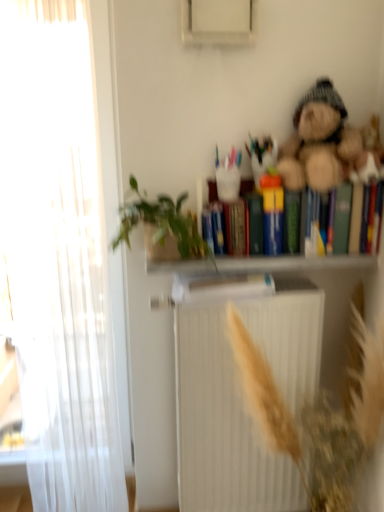
Question: Is multicolored hardcover books at upper right turned away from white matte bookcase at upper center?

Choices:
 (A) no
 (B) yes

Answer: (A)

Question: From a real-world perspective, is multicolored hardcover books at upper right below white matte bookcase at upper center?

Choices:
 (A) yes
 (B) no

Answer: (B)

Question: Considering the relative positions of multicolored hardcover books at upper right and white matte bookcase at upper center in the image provided, is multicolored hardcover books at upper right in front of white matte bookcase at upper center?

Choices:
 (A) no
 (B) yes

Answer: (A)

Question: Is multicolored hardcover books at upper right further to the viewer compared to white matte bookcase at upper center?

Choices:
 (A) no
 (B) yes

Answer: (B)

Question: From the image's perspective, is multicolored hardcover books at upper right located above white matte bookcase at upper center?

Choices:
 (A) yes
 (B) no

Answer: (A)

Question: Is multicolored hardcover books at upper right bigger than white matte bookcase at upper center?

Choices:
 (A) no
 (B) yes

Answer: (A)

Question: Does white matte radiator at center have a greater width compared to multicolored hardcover books at upper right?

Choices:
 (A) no
 (B) yes

Answer: (B)

Question: From the image's perspective, is white matte radiator at center located above multicolored hardcover books at upper right?

Choices:
 (A) yes
 (B) no

Answer: (B)

Question: Is white matte radiator at center smaller than multicolored hardcover books at upper right?

Choices:
 (A) yes
 (B) no

Answer: (B)

Question: From a real-world perspective, does white matte radiator at center stand above multicolored hardcover books at upper right?

Choices:
 (A) no
 (B) yes

Answer: (A)

Question: Is white matte radiator at center located outside multicolored hardcover books at upper right?

Choices:
 (A) yes
 (B) no

Answer: (A)

Question: Is white matte radiator at center positioned with its back to multicolored hardcover books at upper right?

Choices:
 (A) yes
 (B) no

Answer: (B)

Question: Is multicolored hardcover books at upper right wider than fuzzy brown teddy bear at upper right?

Choices:
 (A) yes
 (B) no

Answer: (B)